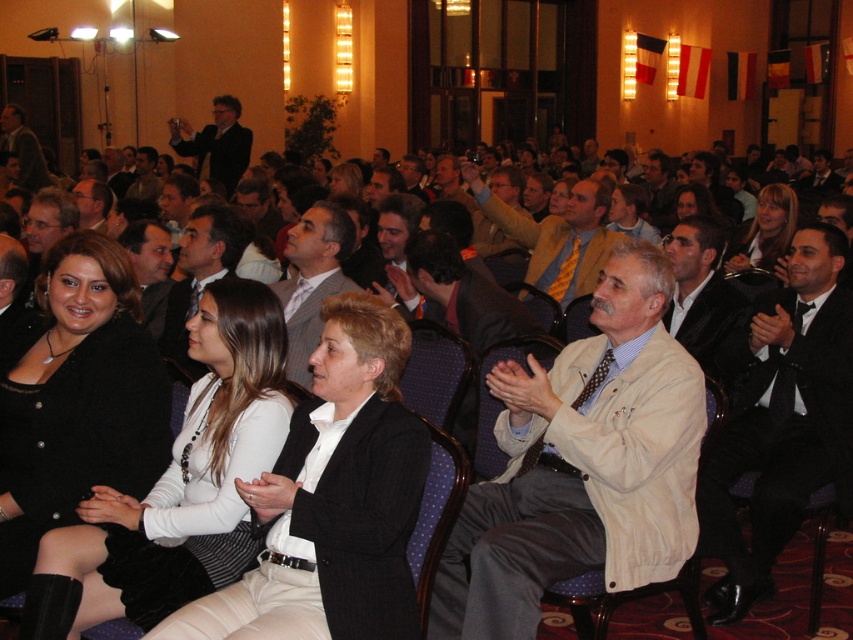
Question: Which object is closer to the camera taking this photo?

Choices:
 (A) beige fabric jacket at center
 (B) black matte jacket at lower left
 (C) black satin suit at center
 (D) blonde hair at center

Answer: (A)

Question: Does black matte jacket at lower left have a greater width compared to black satin suit at center?

Choices:
 (A) yes
 (B) no

Answer: (B)

Question: Which point is farther to the camera?

Choices:
 (A) (242, 291)
 (B) (117, 458)
 (C) (602, 460)
 (D) (834, 304)

Answer: (D)

Question: Which of the following is the farthest from the observer?

Choices:
 (A) (48, 349)
 (B) (287, 419)

Answer: (A)

Question: Is black fabric dress at lower left wider than black satin suit at center?

Choices:
 (A) yes
 (B) no

Answer: (B)

Question: Considering the relative positions of black satin suit at center and blonde hair at center in the image provided, where is black satin suit at center located with respect to blonde hair at center?

Choices:
 (A) below
 (B) above

Answer: (A)